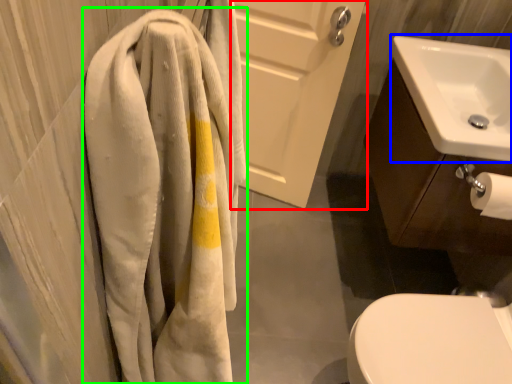
Question: Which is nearer to the screen door (highlighted by a red box)? sink (highlighted by a blue box) or towel (highlighted by a green box).

Choices:
 (A) sink
 (B) towel

Answer: (A)